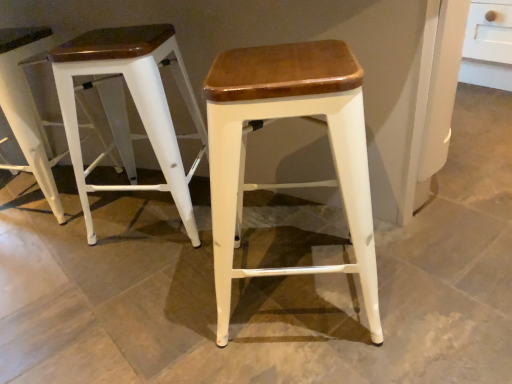
Question: Should I look upward or downward to see white matte stool at left, which is the 1th stool from left to right?

Choices:
 (A) down
 (B) up

Answer: (B)

Question: Does white wood stool at center, the third stool when ordered from left to right, have a lesser height compared to white matte stool at left, which is counted as the 2th stool, starting from the right?

Choices:
 (A) yes
 (B) no

Answer: (B)

Question: From the image's perspective, is white wood stool at center, the third stool when ordered from left to right, under white matte stool at left, which is counted as the second stool, starting from the left?

Choices:
 (A) yes
 (B) no

Answer: (A)

Question: Considering the relative sizes of white wood stool at center, the 1th stool viewed from the right, and white matte stool at left, which is counted as the 2th stool, starting from the right, in the image provided, is white wood stool at center, the 1th stool viewed from the right, taller than white matte stool at left, which is counted as the 2th stool, starting from the right,?

Choices:
 (A) yes
 (B) no

Answer: (A)

Question: Is white wood stool at center, the 1th stool viewed from the right, placed right next to white matte stool at left, which is counted as the 2th stool, starting from the right?

Choices:
 (A) yes
 (B) no

Answer: (B)

Question: Is white wood stool at center, the third stool when ordered from left to right, to the right of white matte stool at left, which is counted as the 2th stool, starting from the right, from the viewer's perspective?

Choices:
 (A) no
 (B) yes

Answer: (B)

Question: Is white wood stool at center, the 1th stool viewed from the right, bigger than white matte stool at left, which is counted as the 2th stool, starting from the right?

Choices:
 (A) yes
 (B) no

Answer: (B)

Question: Is white matte stool at left, which is the 1th stool from left to right, not near white matte stool at left, which is counted as the second stool, starting from the left?

Choices:
 (A) yes
 (B) no

Answer: (B)

Question: Does white matte stool at left, which is the 1th stool from left to right, have a lesser width compared to white matte stool at left, which is counted as the second stool, starting from the left?

Choices:
 (A) yes
 (B) no

Answer: (A)

Question: Can you confirm if white matte stool at left, acting as the 3th stool starting from the right, is taller than white matte stool at left, which is counted as the second stool, starting from the left?

Choices:
 (A) no
 (B) yes

Answer: (B)

Question: From a real-world perspective, is white matte stool at left, which is the 1th stool from left to right, beneath white matte stool at left, which is counted as the 2th stool, starting from the right?

Choices:
 (A) no
 (B) yes

Answer: (A)

Question: Is white matte stool at left, which is the 1th stool from left to right, located outside white matte stool at left, which is counted as the second stool, starting from the left?

Choices:
 (A) no
 (B) yes

Answer: (B)

Question: Is white matte stool at left, which is counted as the 2th stool, starting from the right, at the back of white matte stool at left, acting as the 3th stool starting from the right?

Choices:
 (A) yes
 (B) no

Answer: (B)